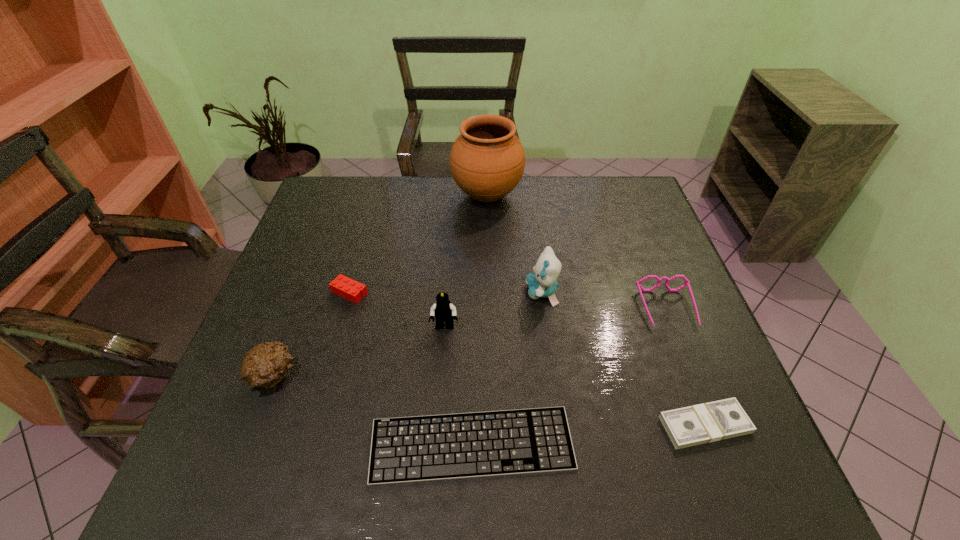
At what (x,y) coordinates should I click in order to perform the action: click on the farthest object. Please return your answer as a coordinate pair (x, y). Looking at the image, I should click on (487, 160).

You are a GUI agent. You are given a task and a screenshot of the screen. Output one action in this format:
    pyautogui.click(x=<x>, y=<y>)
    Task: Click on the tallest object
    The width and height of the screenshot is (960, 540).
    Given the screenshot: What is the action you would take?
    pyautogui.click(x=487, y=160)

Where is `kitten`? The image size is (960, 540). kitten is located at coordinates (542, 283).

Find the location of a particular element. the sixth shortest object is located at coordinates (443, 310).

The image size is (960, 540). I want to click on the taller Lego, so click(x=443, y=310).

You are a GUI agent. You are given a task and a screenshot of the screen. Output one action in this format:
    pyautogui.click(x=<x>, y=<y>)
    Task: Click on the third nearest object
    Image resolution: width=960 pixels, height=540 pixels.
    Given the screenshot: What is the action you would take?
    pyautogui.click(x=264, y=366)

Locate an element on the screen. The image size is (960, 540). the leftmost object is located at coordinates (264, 366).

At what (x,y) coordinates should I click in order to perform the action: click on the fourth shortest object. Please return your answer as a coordinate pair (x, y). The height and width of the screenshot is (540, 960). Looking at the image, I should click on (687, 283).

The height and width of the screenshot is (540, 960). I want to click on the sixth tallest object, so click(350, 289).

I want to click on the farther Lego, so click(x=350, y=289).